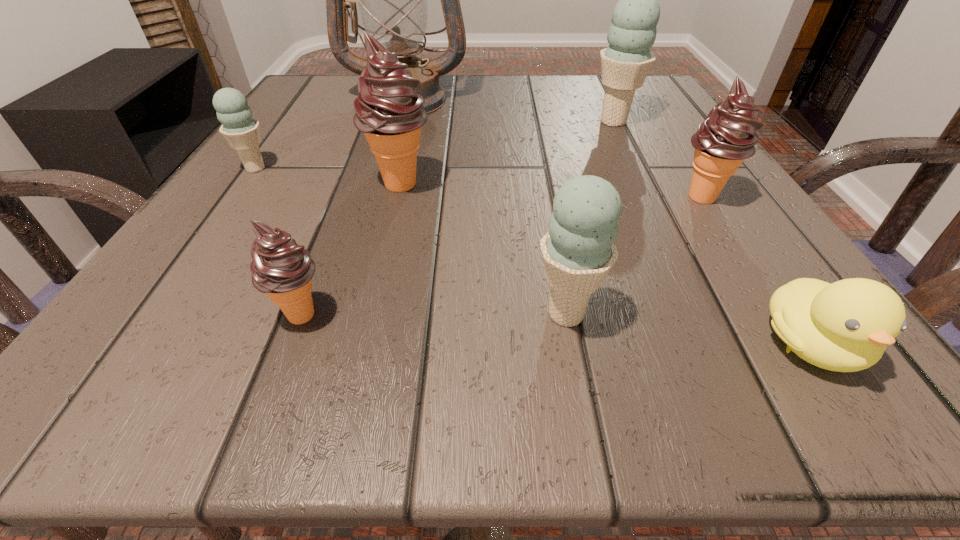
This screenshot has width=960, height=540. I want to click on oil lamp positioned at the far edge, so click(x=392, y=0).

The height and width of the screenshot is (540, 960). I want to click on ice cream present at the far edge, so click(x=625, y=63).

Image resolution: width=960 pixels, height=540 pixels. What are the coordinates of `duckling located in the near edge section of the desktop` in the screenshot? It's located at (845, 326).

Locate an element on the screen. The image size is (960, 540). oil lamp that is at the left edge is located at coordinates (392, 0).

Where is `duckling that is at the right edge`? This screenshot has width=960, height=540. duckling that is at the right edge is located at coordinates (845, 326).

Identify the location of object at the far left corner. This screenshot has height=540, width=960. (392, 0).

This screenshot has width=960, height=540. Identify the location of object that is at the near left corner. tap(283, 270).

Find the location of a particular element. Image resolution: width=960 pixels, height=540 pixels. object located at the far right corner is located at coordinates (625, 63).

Identify the location of object located at the near right corner. Image resolution: width=960 pixels, height=540 pixels. (845, 326).

This screenshot has width=960, height=540. I want to click on free region at the far edge of the desktop, so click(510, 92).